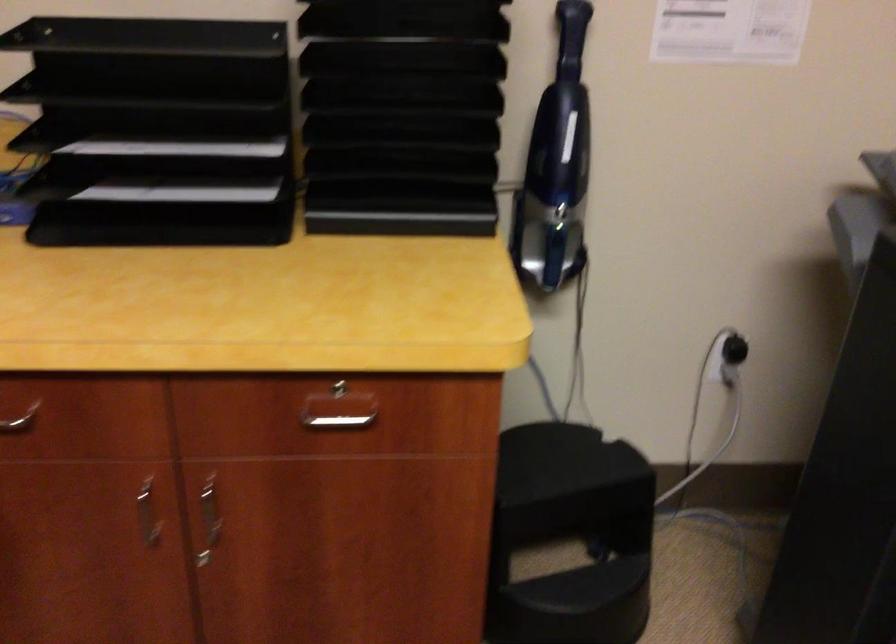
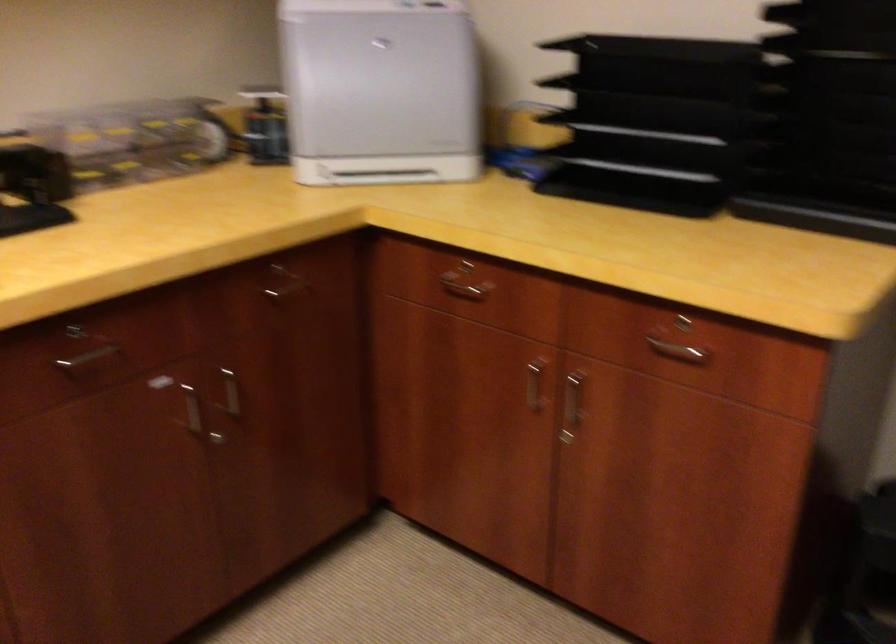
Where in the second image is the point corresponding to pixel 202 512 from the first image?

(572, 401)